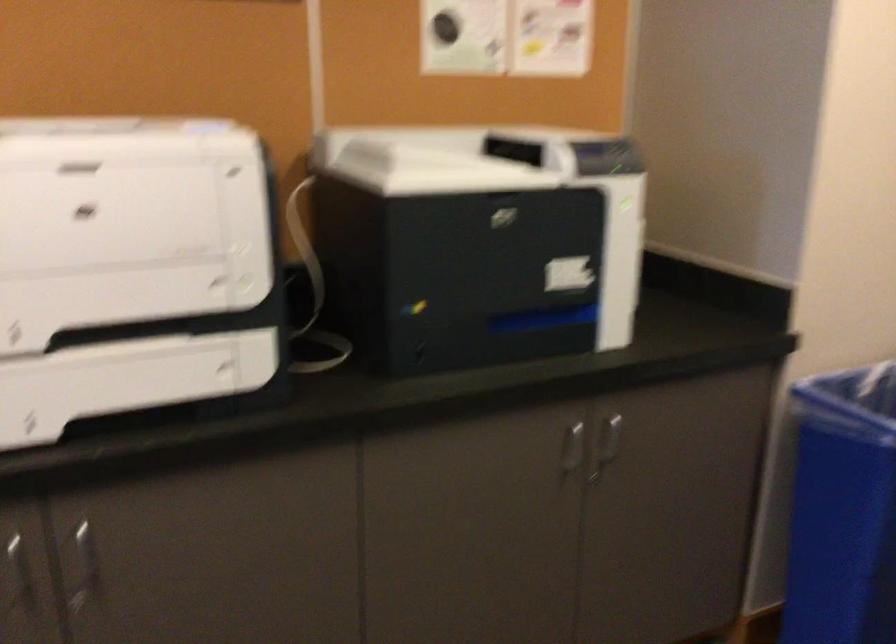
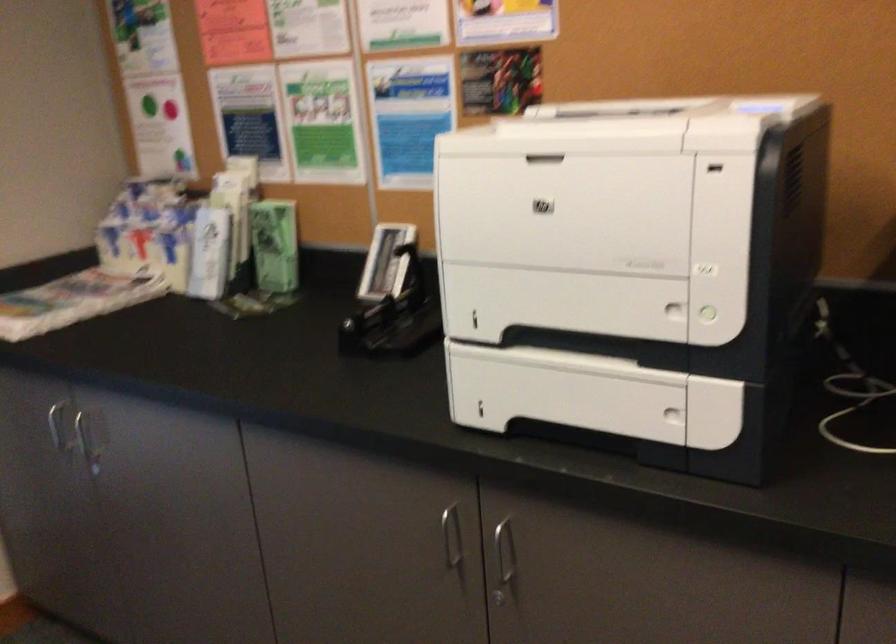
Find the pixel in the second image that matches pixel 252 281 in the first image.

(709, 314)